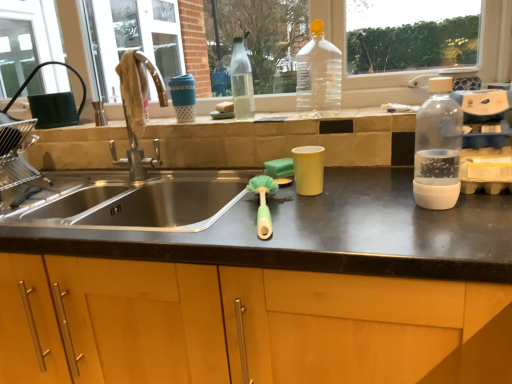
Question: From the image's perspective, would you say transparent plastic bottle at right, which is the third bottle from back to front, is shown under green sponge at center?

Choices:
 (A) no
 (B) yes

Answer: (A)

Question: Considering the relative sizes of transparent plastic bottle at right, which is the third bottle from back to front, and green sponge at center in the image provided, is transparent plastic bottle at right, which is the third bottle from back to front, bigger than green sponge at center?

Choices:
 (A) yes
 (B) no

Answer: (A)

Question: Is transparent plastic bottle at right, acting as the third bottle starting from the left, wider than green sponge at center?

Choices:
 (A) yes
 (B) no

Answer: (A)

Question: Is transparent plastic bottle at right, acting as the third bottle starting from the left, in front of green sponge at center?

Choices:
 (A) no
 (B) yes

Answer: (B)

Question: Can you confirm if transparent plastic bottle at right, the first bottle from the front, is thinner than green sponge at center?

Choices:
 (A) yes
 (B) no

Answer: (B)

Question: Is the position of transparent plastic bottle at right, the first bottle from the right, more distant than that of green sponge at center?

Choices:
 (A) yes
 (B) no

Answer: (B)

Question: Is transparent plastic bottle at upper center, which appears as the second bottle when viewed from the right, placed right next to green sponge at center?

Choices:
 (A) yes
 (B) no

Answer: (B)

Question: Does transparent plastic bottle at upper center, which appears as the 2th bottle when viewed from the back, appear on the right side of green sponge at center?

Choices:
 (A) no
 (B) yes

Answer: (B)

Question: Can you confirm if transparent plastic bottle at upper center, which appears as the second bottle when viewed from the right, is smaller than green sponge at center?

Choices:
 (A) yes
 (B) no

Answer: (B)

Question: Would you say transparent plastic bottle at upper center, which appears as the second bottle when viewed from the right, contains green sponge at center?

Choices:
 (A) yes
 (B) no

Answer: (B)

Question: Does transparent plastic bottle at upper center, which is counted as the second bottle, starting from the front, have a larger size compared to green sponge at center?

Choices:
 (A) no
 (B) yes

Answer: (B)

Question: From the image's perspective, is transparent plastic bottle at upper center, arranged as the second bottle when viewed from the left, on top of green sponge at center?

Choices:
 (A) yes
 (B) no

Answer: (A)

Question: Is transparent plastic bottle at right, the first bottle from the front, closer to camera compared to green rubber brush at center?

Choices:
 (A) no
 (B) yes

Answer: (A)